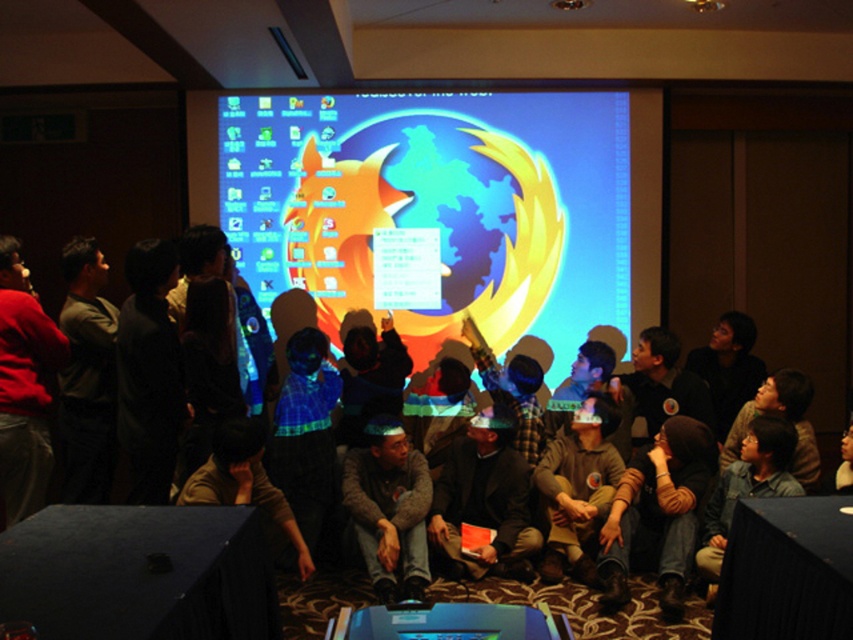
You are organizing a clothing donation drive and need to categorize items by size. You have two garments in front of you, the matte red sweater at left and the brown fabric shirt at center. Based on their widths, which one would you place in the smaller size bin?

The matte red sweater at left has a smaller width than the brown fabric shirt at center, so it should be placed in the smaller size bin.

You are standing at the entrance of the conference room and see two points marked on the floor. The first point is at coordinate point (36, 394) and the second is at point (585, 540). If you want to walk towards the screen at the front of the room, which point should you step on first?

You should step on point (36, 394) first because it is in front of point (585, 540), meaning it is closer to the screen at the front of the room.

You are a participant in the meeting and want to show your colleague the Firefox browser logo displayed on the screen. Which object should you point to first, the matte plastic screen at center or the brown fabric shirt at lower center?

You should point to the matte plastic screen at center first because it is larger in size than the brown fabric shirt at lower center, making it more visible and the correct object to indicate the Firefox browser logo.